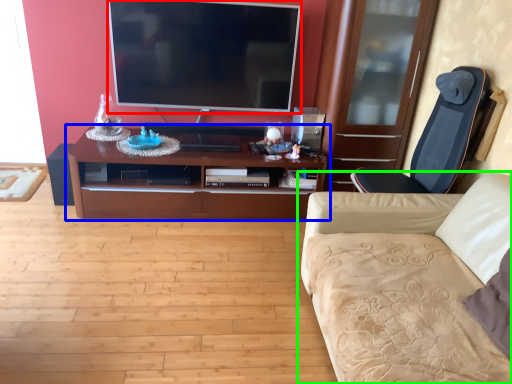
Question: Which object is positioned farthest from television (highlighted by a red box)? Select from cabinetry (highlighted by a blue box) and studio couch (highlighted by a green box).

Choices:
 (A) cabinetry
 (B) studio couch

Answer: (B)